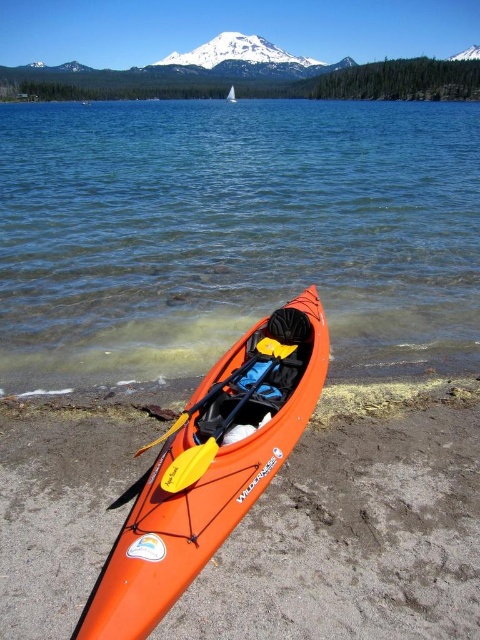
Question: Where is orange plastic kayak at lower center located in relation to orange plastic kayak at center in the image?

Choices:
 (A) above
 (B) below

Answer: (B)

Question: Which is farther from the orange matte kayak at lower left?

Choices:
 (A) yellow plastic paddle at center
 (B) orange plastic kayak at lower center

Answer: (B)

Question: Can you confirm if yellow plastic paddle at center is bigger than orange plastic kayak at center?

Choices:
 (A) no
 (B) yes

Answer: (A)

Question: Which is farther from the orange plastic kayak at center?

Choices:
 (A) yellow plastic paddle at center
 (B) orange plastic kayak at lower center
 (C) orange matte kayak at lower left
 (D) yellow foam paddle at center

Answer: (A)

Question: Which point is farther to the camera?

Choices:
 (A) (52, 333)
 (B) (157, 460)

Answer: (A)

Question: In this image, where is orange plastic kayak at lower center located relative to orange matte kayak at lower left?

Choices:
 (A) below
 (B) above

Answer: (B)